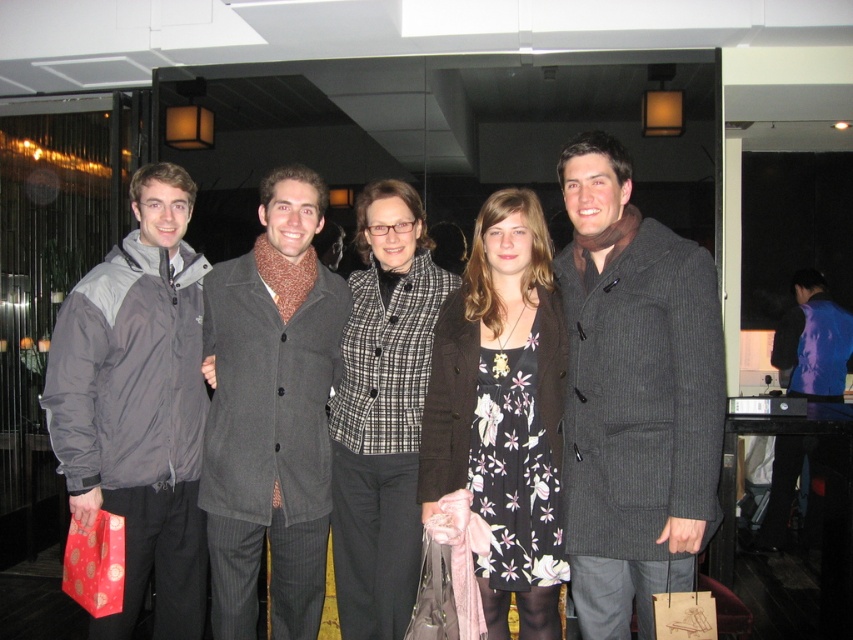
Is gray synthetic jacket at left shorter than matte black jacket at center?

In fact, gray synthetic jacket at left may be taller than matte black jacket at center.

Is point (154, 317) positioned after point (547, 426)?

Yes, it is.

The image size is (853, 640). What are the coordinates of `gray synthetic jacket at left` in the screenshot? It's located at (138, 404).

From the picture: Which is above, dark gray pinstripe coat at center or gray wool coat at center?

dark gray pinstripe coat at center is higher up.

Which is in front, point (643, 518) or point (271, 264)?

Point (643, 518) is more forward.

Does point (699, 416) come in front of point (289, 188)?

Yes, it is.

Locate an element on the screen. Image resolution: width=853 pixels, height=640 pixels. dark gray pinstripe coat at center is located at coordinates (634, 396).

Between matte black jacket at center and plaid wool jacket at center, which one appears on the right side from the viewer's perspective?

matte black jacket at center is more to the right.

Is point (585, 136) positioned in front of point (402, 493)?

That is True.

Identify the location of matte black jacket at center. (488, 348).